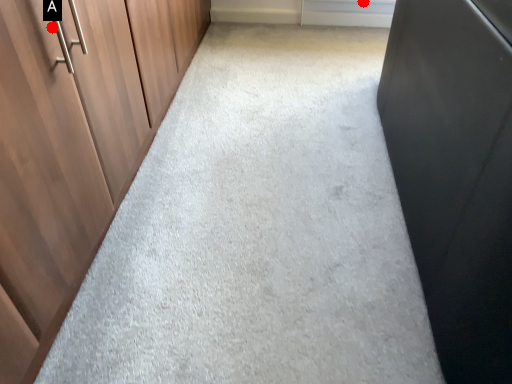
Question: Two points are circled on the image, labeled by A and B beside each circle. Which of the following is the closest to the observer?

Choices:
 (A) A is closer
 (B) B is closer

Answer: (A)